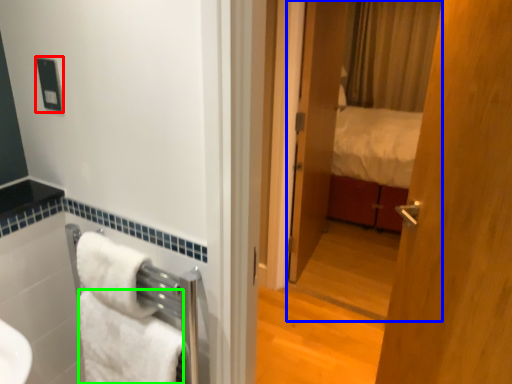
Question: Considering the real-world distances, which object is farthest from electric outlet (highlighted by a red box)? mirror (highlighted by a blue box) or towel/napkin (highlighted by a green box)?

Choices:
 (A) mirror
 (B) towel/napkin

Answer: (A)